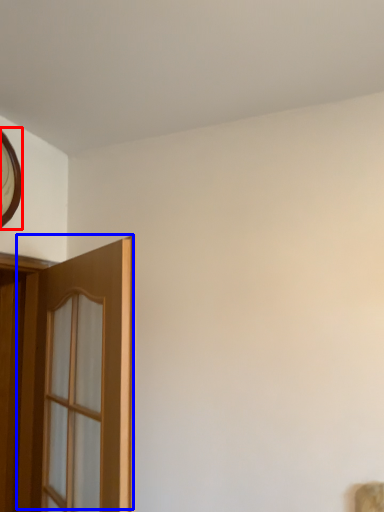
Question: Which object is closer to the camera taking this photo, clock (highlighted by a red box) or door (highlighted by a blue box)?

Choices:
 (A) clock
 (B) door

Answer: (B)